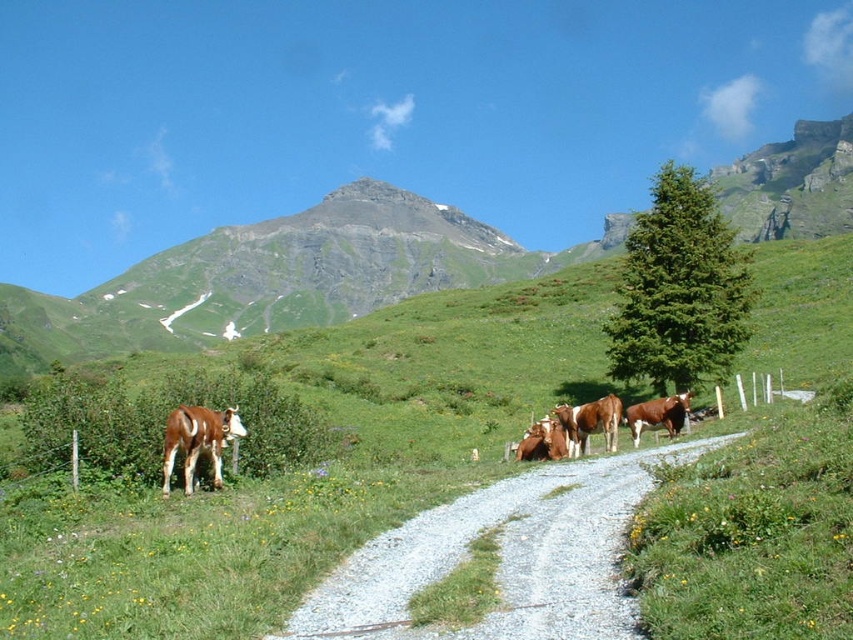
Question: Is green grassy at center below green grassy mountain at upper center?

Choices:
 (A) no
 (B) yes

Answer: (B)

Question: Which object is the closest to the green grassy mountain at upper center?

Choices:
 (A) green grassy at center
 (B) gravel road at center

Answer: (A)

Question: Can you confirm if green grassy at center is thinner than green grassy mountain at upper center?

Choices:
 (A) yes
 (B) no

Answer: (A)

Question: Does green grassy mountain at upper center appear over gravel road at center?

Choices:
 (A) yes
 (B) no

Answer: (A)

Question: Which point is farther to the camera?

Choices:
 (A) (265, 276)
 (B) (660, 422)
 (C) (265, 337)

Answer: (A)

Question: Which point is farther to the camera?

Choices:
 (A) gravel road at center
 (B) green grassy mountain at upper center

Answer: (B)